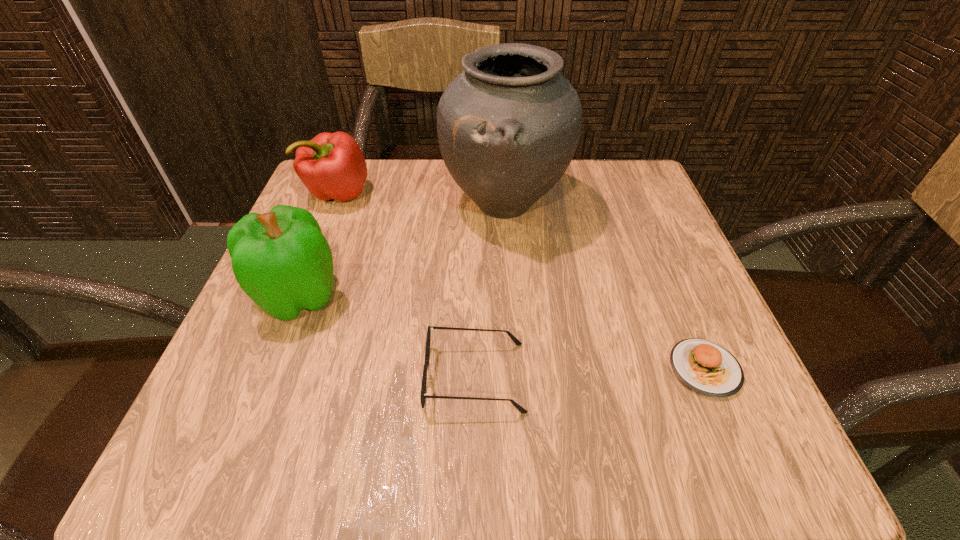
Locate an element on the screen. The height and width of the screenshot is (540, 960). vacant space located 0.050m on the back of the farther bell pepper is located at coordinates (349, 165).

Find the location of a particular element. The height and width of the screenshot is (540, 960). vacant space situated 0.090m with the lenses facing outward on the spectacles is located at coordinates (588, 377).

Where is `free point located on the back of the rightmost object`? The height and width of the screenshot is (540, 960). free point located on the back of the rightmost object is located at coordinates (632, 195).

Find the location of a particular element. This screenshot has height=540, width=960. urn that is at the far edge is located at coordinates (508, 126).

Locate an element on the screen. The height and width of the screenshot is (540, 960). bell pepper that is at the far edge is located at coordinates (331, 165).

What are the coordinates of `object that is at the near edge` in the screenshot? It's located at (423, 395).

Locate an element on the screen. The width and height of the screenshot is (960, 540). object that is positioned at the right edge is located at coordinates (707, 368).

The height and width of the screenshot is (540, 960). Find the location of `object positioned at the far left corner`. object positioned at the far left corner is located at coordinates (331, 165).

At what (x,y) coordinates should I click in order to perform the action: click on free point at the far edge. Please return your answer as a coordinate pair (x, y). The height and width of the screenshot is (540, 960). Looking at the image, I should click on (426, 174).

Locate an element on the screen. vacant space at the left edge of the desktop is located at coordinates (331, 242).